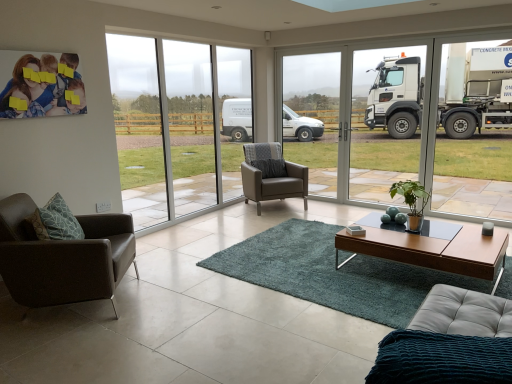
At what (x,y) coordinates should I click in order to perform the action: click on free space in front of leather armchair at center, which ranks as the second chair in left-to-right order. Please return your answer as a coordinate pair (x, y). This screenshot has height=384, width=512. Looking at the image, I should click on (256, 221).